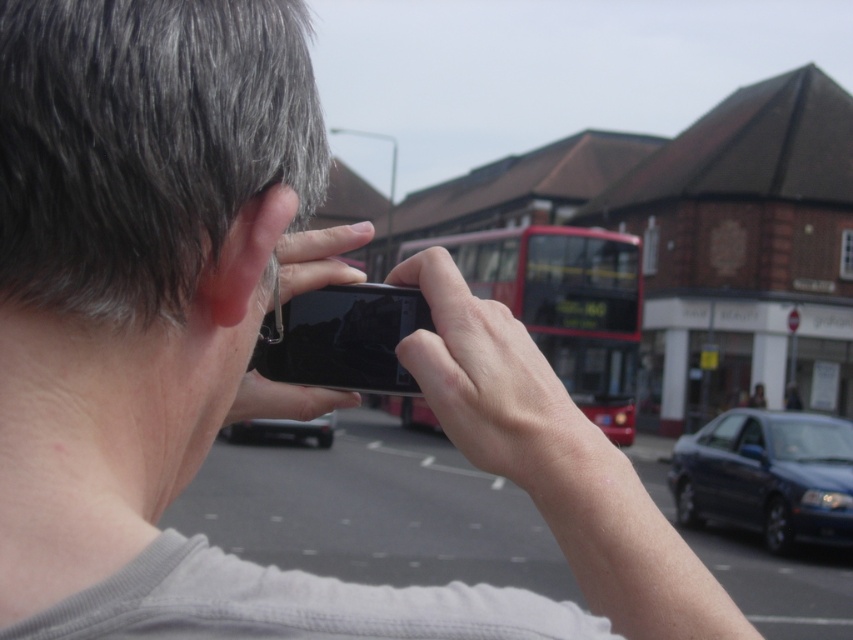
Question: Is smooth skin hand at center above black glossy smartphone at center?

Choices:
 (A) yes
 (B) no

Answer: (B)

Question: Which object appears farthest from the camera in this image?

Choices:
 (A) smooth skin hand at center
 (B) shiny dark blue sedan at center-right

Answer: (B)

Question: Can you confirm if smooth skin hand at center is positioned below black glossy smartphone at center?

Choices:
 (A) yes
 (B) no

Answer: (A)

Question: Which point appears closest to the camera in this image?

Choices:
 (A) (404, 291)
 (B) (308, 429)

Answer: (A)

Question: Which point is closer to the camera taking this photo?

Choices:
 (A) (786, 449)
 (B) (238, 404)

Answer: (B)

Question: Where is black glossy smartphone at center located in relation to shiny black car at center in the image?

Choices:
 (A) left
 (B) right

Answer: (B)